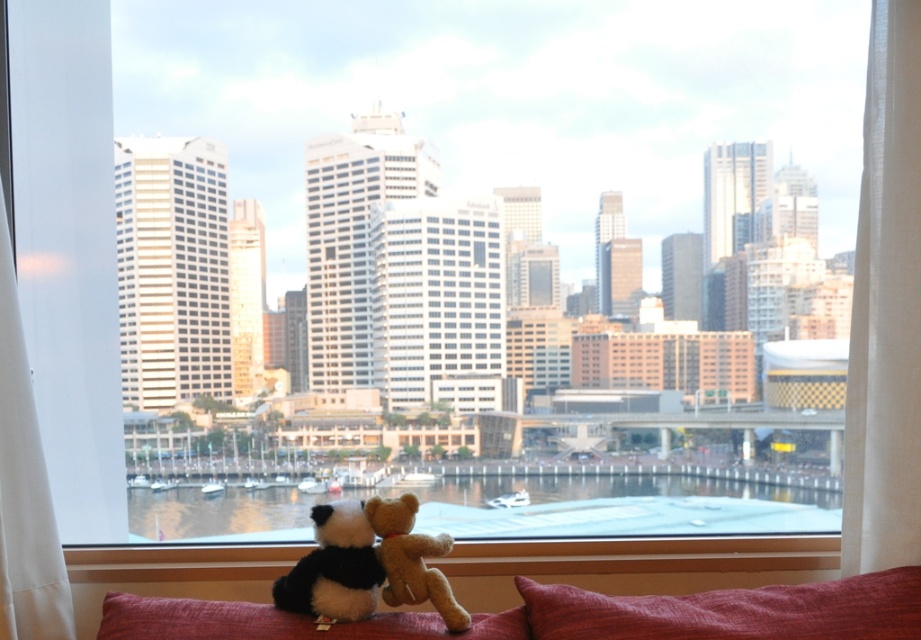
The width and height of the screenshot is (921, 640). What are the coordinates of `velvet red couch at lower center` in the screenshot? It's located at (717, 612).

Does velvet red couch at lower center appear over velvety red pillow at lower center?

Correct, velvet red couch at lower center is located above velvety red pillow at lower center.

Is point (708, 632) positioned behind point (717, 618)?

That is False.

You are a GUI agent. You are given a task and a screenshot of the screen. Output one action in this format:
    pyautogui.click(x=<x>, y=<y>)
    Task: Click on the velvet red couch at lower center
    
    Given the screenshot: What is the action you would take?
    pyautogui.click(x=717, y=612)

In the scene shown: Can you confirm if velvet red couch at lower center is positioned to the right of white sheer curtain at left?

Indeed, velvet red couch at lower center is positioned on the right side of white sheer curtain at left.

Can you confirm if velvet red couch at lower center is bigger than white sheer curtain at left?

No, velvet red couch at lower center is not bigger than white sheer curtain at left.

The width and height of the screenshot is (921, 640). What do you see at coordinates (717, 612) in the screenshot? I see `velvet red couch at lower center` at bounding box center [717, 612].

Identify the location of velvet red couch at lower center. The height and width of the screenshot is (640, 921). (717, 612).

Based on the photo, is white sheer curtain at right wider than velvety red pillow at lower center?

No, white sheer curtain at right is not wider than velvety red pillow at lower center.

Can you confirm if white sheer curtain at right is taller than velvety red pillow at lower center?

Yes.

Image resolution: width=921 pixels, height=640 pixels. What do you see at coordinates (885, 307) in the screenshot?
I see `white sheer curtain at right` at bounding box center [885, 307].

You are a GUI agent. You are given a task and a screenshot of the screen. Output one action in this format:
    pyautogui.click(x=<x>, y=<y>)
    Task: Click on the white sheer curtain at right
    The height and width of the screenshot is (640, 921).
    Given the screenshot: What is the action you would take?
    pyautogui.click(x=885, y=307)